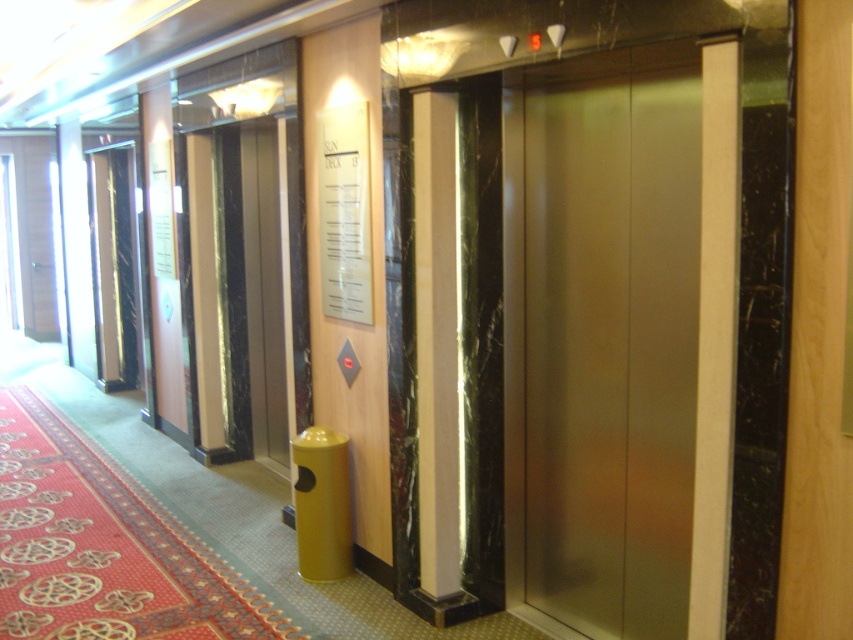
Can you confirm if satin gold elevator at center is positioned above white marble pillar at center?

Incorrect, satin gold elevator at center is not positioned above white marble pillar at center.

Based on the photo, which is more to the right, satin gold elevator at center or white marble pillar at center?

From the viewer's perspective, satin gold elevator at center appears more on the right side.

Which is in front, point (697, 196) or point (436, 449)?

Point (697, 196) is in front.

I want to click on satin gold elevator at center, so click(x=602, y=337).